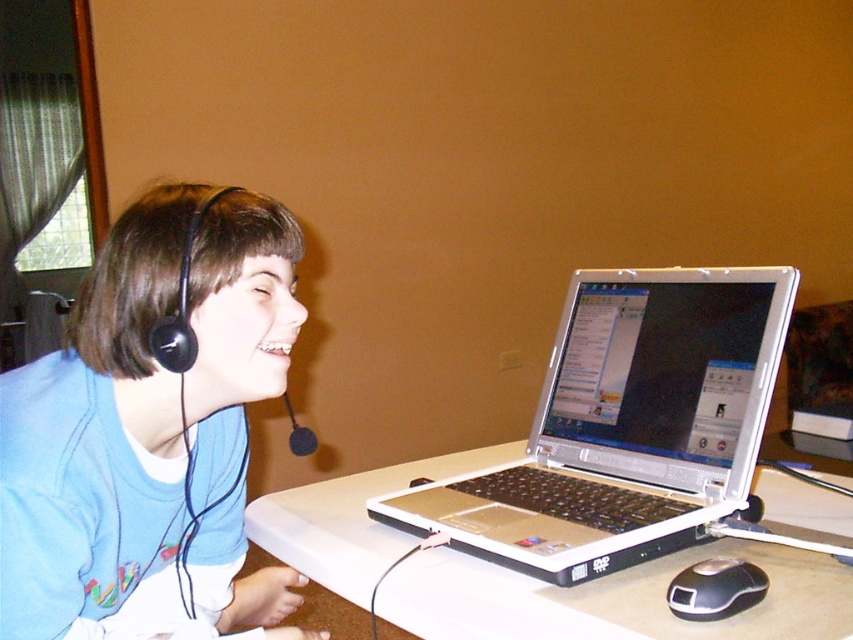
Can you confirm if black glossy mouse at lower right is bigger than black matte microphone at left?

Incorrect, black glossy mouse at lower right is not larger than black matte microphone at left.

Can you confirm if black glossy mouse at lower right is positioned to the right of black matte microphone at left?

Yes, black glossy mouse at lower right is to the right of black matte microphone at left.

The image size is (853, 640). What do you see at coordinates (715, 589) in the screenshot?
I see `black glossy mouse at lower right` at bounding box center [715, 589].

You are a GUI agent. You are given a task and a screenshot of the screen. Output one action in this format:
    pyautogui.click(x=<x>, y=<y>)
    Task: Click on the black glossy mouse at lower right
    
    Given the screenshot: What is the action you would take?
    (715, 589)

Between silver metallic laptop at center and black matte microphone at left, which one appears on the left side from the viewer's perspective?

black matte microphone at left

Is point (642, 557) positioned before point (294, 445)?

Yes, it is.

The height and width of the screenshot is (640, 853). Find the location of `silver metallic laptop at center`. silver metallic laptop at center is located at coordinates (625, 426).

How distant is silver metallic laptop at center from white plastic table at center?

silver metallic laptop at center and white plastic table at center are 5.34 inches apart.

Does silver metallic laptop at center come in front of white plastic table at center?

No.

Who is more forward, [654,531] or [596,634]?

Point [596,634] is more forward.

Identify the location of silver metallic laptop at center. (625, 426).